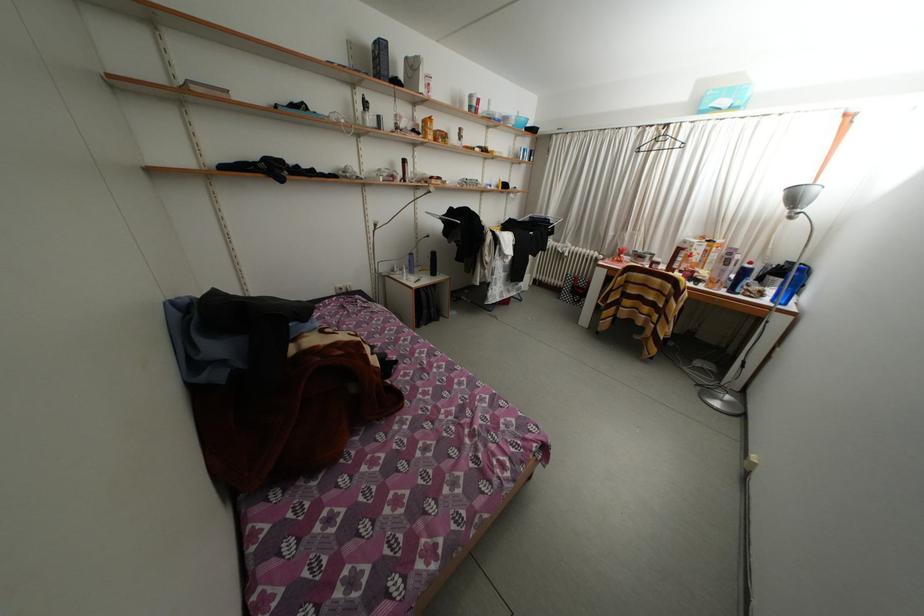
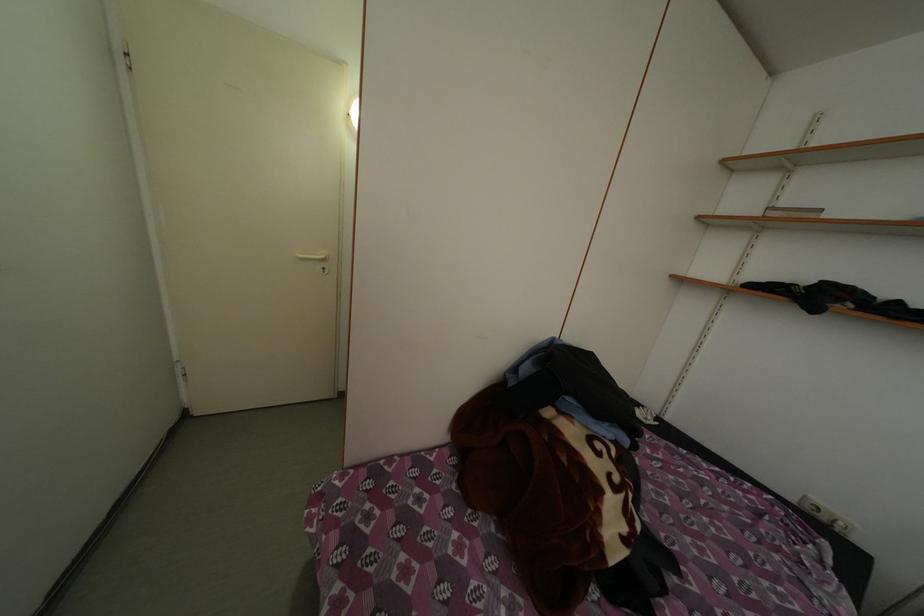
Based on the continuous images, in which direction is the camera rotating?

The camera rotated toward left-down.